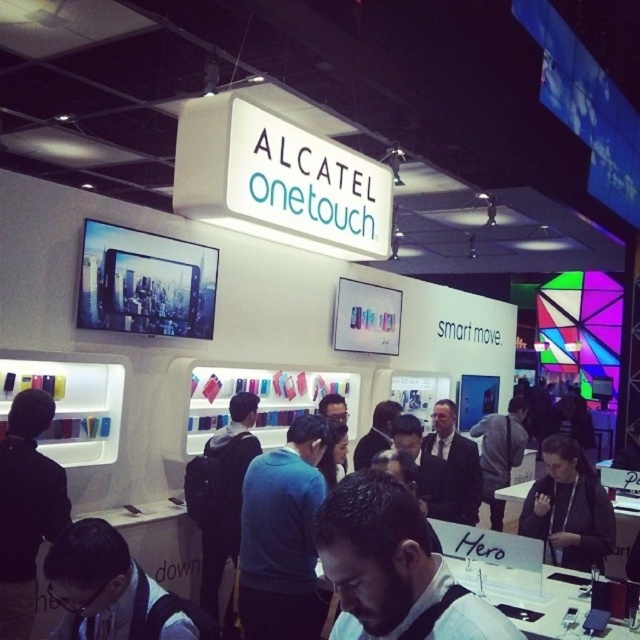
Who is lower down, black fabric at center or black fabric jacket at center?

black fabric jacket at center is lower down.

Who is more forward, (573, 472) or (497, 465)?

Positioned in front is point (573, 472).

Where is `black fabric at center`? The height and width of the screenshot is (640, 640). black fabric at center is located at coordinates (568, 508).

Who is shorter, black matte phone at lower left or black backpack at center?

black matte phone at lower left

Does black matte phone at lower left have a greater height compared to black backpack at center?

Incorrect, black matte phone at lower left's height is not larger of black backpack at center's.

Does point (51, 518) lie in front of point (218, 460)?

Yes, point (51, 518) is closer to viewer.

What are the coordinates of `black matte phone at lower left` in the screenshot? It's located at (26, 508).

Consider the image. Between blue sweater at center and black backpack at center, which one appears on the left side from the viewer's perspective?

From the viewer's perspective, black backpack at center appears more on the left side.

Does blue sweater at center have a greater height compared to black backpack at center?

In fact, blue sweater at center may be shorter than black backpack at center.

Is point (301, 499) farther from viewer compared to point (198, 464)?

No, (301, 499) is closer to viewer.

You are a GUI agent. You are given a task and a screenshot of the screen. Output one action in this format:
    pyautogui.click(x=<x>, y=<y>)
    Task: Click on the blue sweater at center
    Image resolution: width=640 pixels, height=640 pixels.
    Given the screenshot: What is the action you would take?
    pyautogui.click(x=282, y=536)